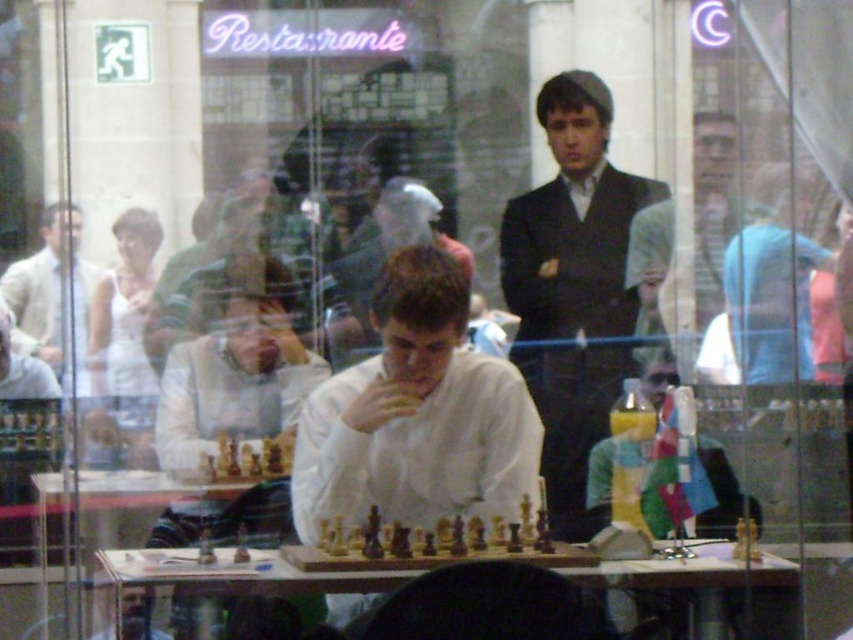
Question: Which of the following is the farthest from the observer?

Choices:
 (A) transparent glass chessboard at center
 (B) wooden chess pieces at center
 (C) black suit at center
 (D) light brown suit at center

Answer: (D)

Question: Does light brown suit at center appear on the left side of transparent glass chessboard at center?

Choices:
 (A) no
 (B) yes

Answer: (A)

Question: Is white matte shirt at center smaller than wooden chess pieces at center?

Choices:
 (A) no
 (B) yes

Answer: (A)

Question: Which point is closer to the camera?

Choices:
 (A) (692, 141)
 (B) (786, 563)
 (C) (509, 492)
 (D) (463, 531)

Answer: (D)

Question: Estimate the real-world distances between objects in this image. Which object is closer to the light brown suit at center?

Choices:
 (A) wooden chess pieces at center
 (B) white matte shirt at center
 (C) black suit at center
 (D) transparent glass chessboard at center

Answer: (C)

Question: Can you confirm if light brown suit at center is wider than wooden chess pieces at center?

Choices:
 (A) no
 (B) yes

Answer: (A)